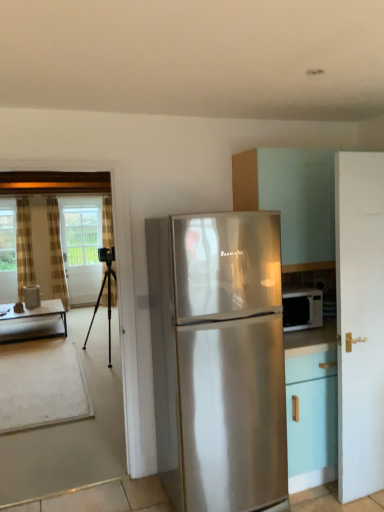
Question: Should I look upward or downward to see white matte door at right?

Choices:
 (A) down
 (B) up

Answer: (A)

Question: Is white glass screen door at left with plaid fabric curtain at left, the first curtain positioned from the right?

Choices:
 (A) yes
 (B) no

Answer: (B)

Question: Does white glass screen door at left have a smaller size compared to plaid fabric curtain at left, which ranks as the third curtain in left-to-right order?

Choices:
 (A) no
 (B) yes

Answer: (B)

Question: Does white glass screen door at left have a lesser width compared to plaid fabric curtain at left, the first curtain positioned from the right?

Choices:
 (A) yes
 (B) no

Answer: (A)

Question: Is white glass screen door at left further to the viewer compared to plaid fabric curtain at left, the first curtain positioned from the right?

Choices:
 (A) yes
 (B) no

Answer: (B)

Question: Could you tell me if white glass screen door at left is turned towards plaid fabric curtain at left, the first curtain positioned from the right?

Choices:
 (A) no
 (B) yes

Answer: (A)

Question: From the image's perspective, is white glass screen door at left on top of plaid fabric curtain at left, the first curtain positioned from the right?

Choices:
 (A) no
 (B) yes

Answer: (A)

Question: From the image's perspective, is white glass screen door at left under white matte door at right?

Choices:
 (A) yes
 (B) no

Answer: (B)

Question: Is white glass screen door at left wider than white matte door at right?

Choices:
 (A) no
 (B) yes

Answer: (A)

Question: Is white glass screen door at left beside white matte door at right?

Choices:
 (A) no
 (B) yes

Answer: (A)

Question: Is white glass screen door at left at the right side of white matte door at right?

Choices:
 (A) no
 (B) yes

Answer: (A)

Question: From a real-world perspective, is white glass screen door at left under white matte door at right?

Choices:
 (A) yes
 (B) no

Answer: (A)

Question: Does white glass screen door at left have a larger size compared to white matte door at right?

Choices:
 (A) no
 (B) yes

Answer: (A)

Question: Is white glossy cabinet at upper right wider than white glossy water at left?

Choices:
 (A) yes
 (B) no

Answer: (A)